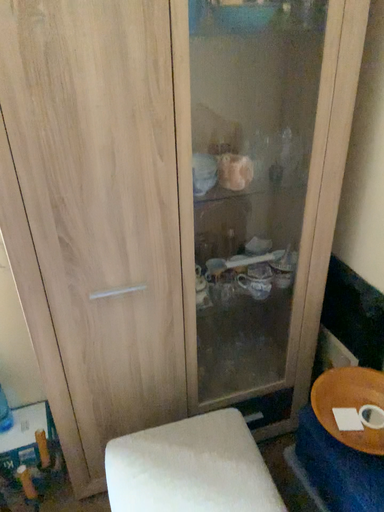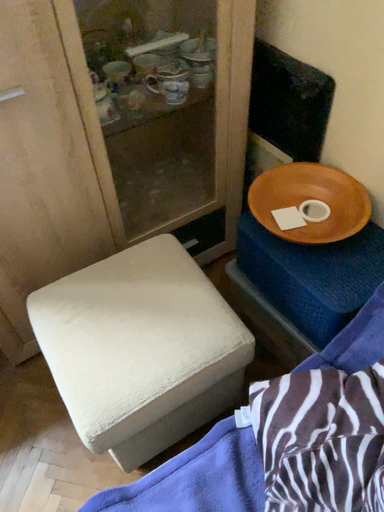
Question: Which way did the camera rotate in the video?

Choices:
 (A) rotated upward
 (B) rotated downward

Answer: (B)